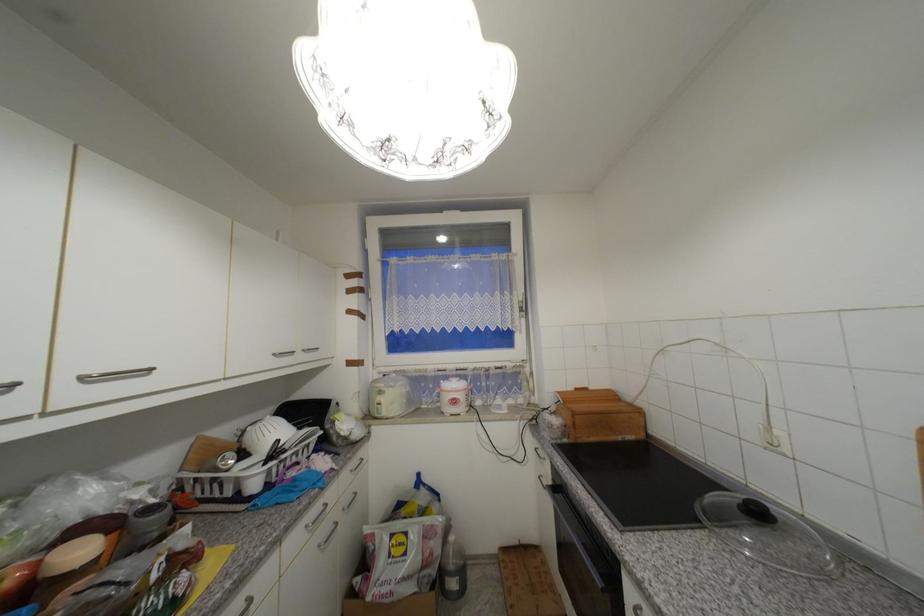
The image size is (924, 616). Describe the element at coordinates (757, 511) in the screenshot. I see `the black lid handle` at that location.